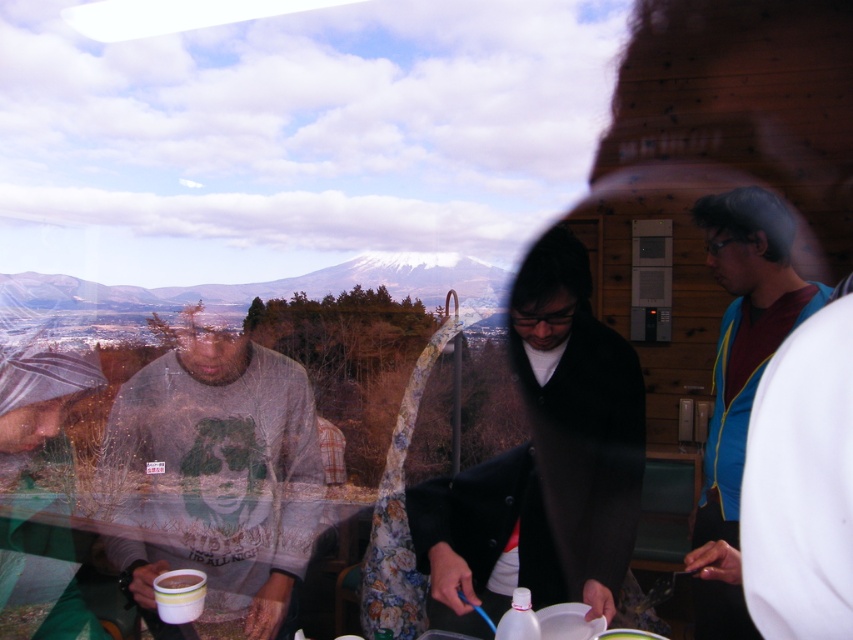
Does black matte coat at center have a lesser width compared to white snow-covered mountain at center?

Correct, black matte coat at center's width is less than white snow-covered mountain at center's.

How much distance is there between black matte coat at center and white snow-covered mountain at center?

black matte coat at center is 7.78 feet away from white snow-covered mountain at center.

Between point (552, 444) and point (480, 294), which one is positioned behind?

Point (480, 294)

At what (x,y) coordinates should I click in order to perform the action: click on black matte coat at center. Please return your answer as a coordinate pair (x, y). This screenshot has width=853, height=640. Looking at the image, I should click on (544, 461).

How much distance is there between white paper cup at lower left and white matte cup at lower left?

white paper cup at lower left and white matte cup at lower left are 1.48 inches apart.

Does white paper cup at lower left have a greater width compared to white matte cup at lower left?

Yes.

This screenshot has height=640, width=853. What do you see at coordinates (178, 595) in the screenshot?
I see `white paper cup at lower left` at bounding box center [178, 595].

Where is `white paper cup at lower left`? Image resolution: width=853 pixels, height=640 pixels. white paper cup at lower left is located at coordinates (178, 595).

Is point (180, 564) in front of point (723, 412)?

Yes, point (180, 564) is in front of point (723, 412).

Find the location of `matte gray shirt at left`. matte gray shirt at left is located at coordinates (213, 474).